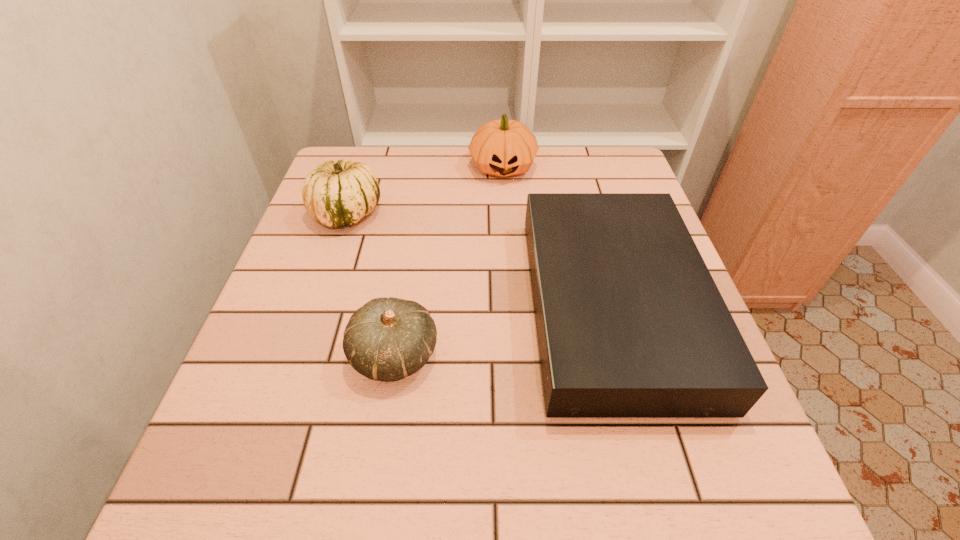
This screenshot has width=960, height=540. Find the location of `free space between the shortest gourd and the CD player`. free space between the shortest gourd and the CD player is located at coordinates (503, 330).

I want to click on vacant area between the leftmost gourd and the third object from right to left, so click(x=371, y=284).

The height and width of the screenshot is (540, 960). I want to click on object that is the third nearest to the second farthest gourd, so click(x=630, y=324).

Identify the location of the third closest object to the CD player. (336, 194).

Where is `gourd that is the second closest one to the rightmost gourd`? gourd that is the second closest one to the rightmost gourd is located at coordinates (387, 339).

Select which gourd is the second closest to the farthest object. Please provide its 2D coordinates. Your answer should be formatted as a tuple, i.e. [(x, y)], where the tuple contains the x and y coordinates of a point satisfying the conditions above.

[(387, 339)]

The width and height of the screenshot is (960, 540). I want to click on vacant space that satisfies the following two spatial constraints: 1. at the front of the CD player for disc insertion; 2. on the front side of the shortest gourd, so click(626, 355).

The width and height of the screenshot is (960, 540). I want to click on free region that satisfies the following two spatial constraints: 1. at the front of the shortest object for disc insertion; 2. on the front side of the nearest gourd, so pyautogui.click(x=626, y=355).

The image size is (960, 540). Identify the location of free space that satisfies the following two spatial constraints: 1. at the front of the shortest object for disc insertion; 2. on the front side of the second gourd from left to right. (626, 355).